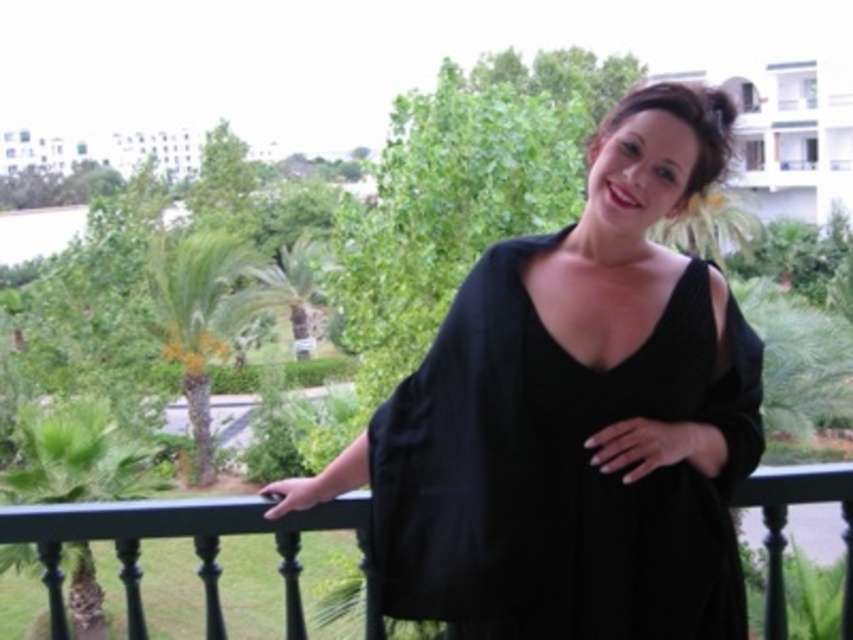
Looking at this image, you are a fashion designer analyzing the positioning of clothing items in the image. Where is the black matte dress at center located in terms of its 2D coordinates?

The black matte dress at center is located at the 2D coordinates point (575, 417).

You are a photographer trying to capture the woman on the balcony. You notice two points in the scene, one at point [207,609] and another at point [799,118]. Which point is closer to your camera lens?

Point [207,609] is closer to the camera than point [799,118].